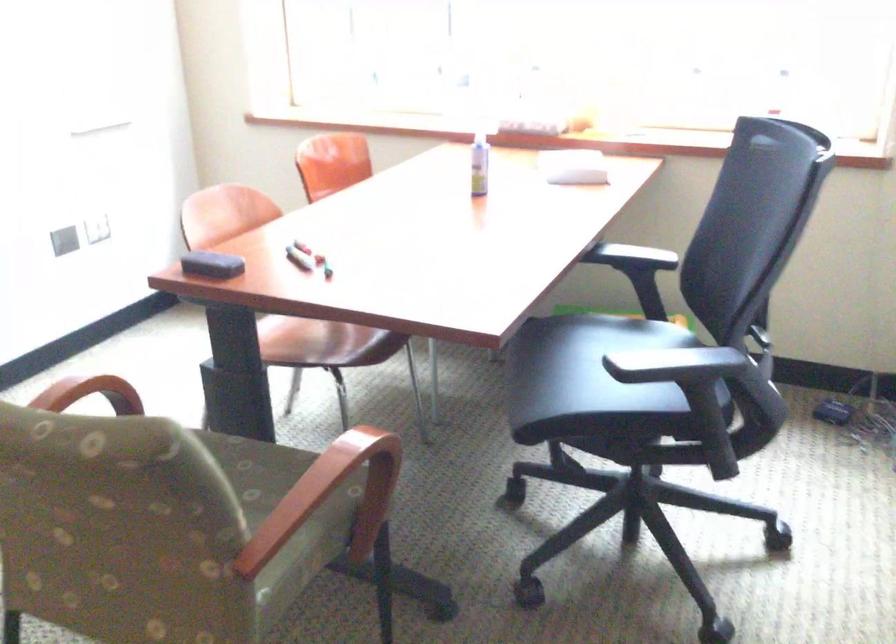
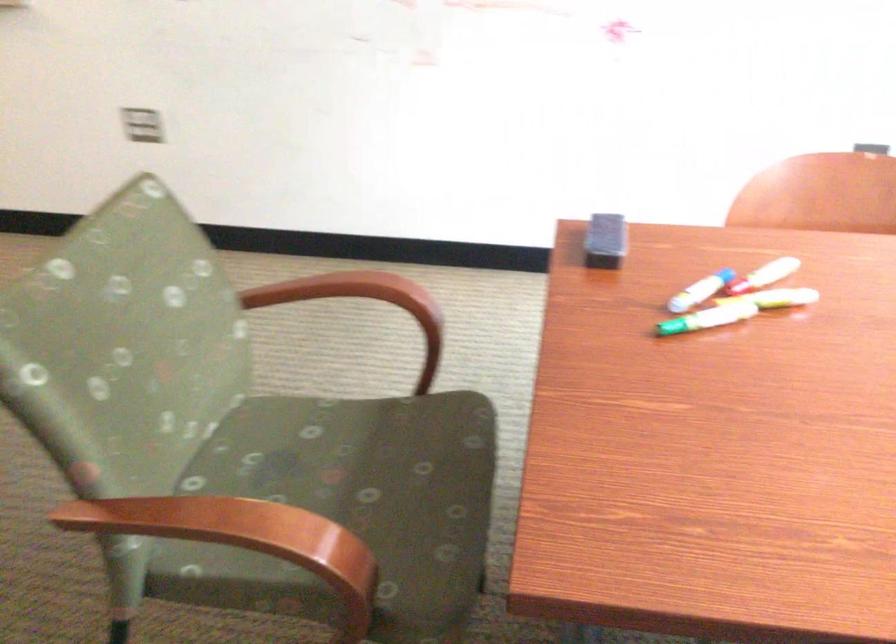
Question: I am providing you with two images of the same scene from different viewpoints. After the viewpoint changes to image2, which objects are now occluded?

Choices:
 (A) printer door handle
 (B) chair sitting surface
 (C) whiteboard eraser
 (D) wooden chair armrest

Answer: (D)